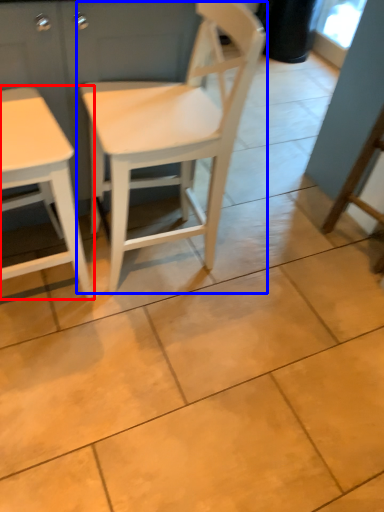
Question: Which object appears closest to the camera in this image, table (highlighted by a red box) or chair (highlighted by a blue box)?

Choices:
 (A) table
 (B) chair

Answer: (A)